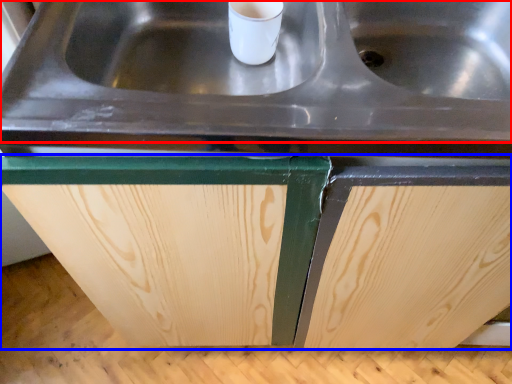
Question: Among these objects, which one is farthest to the camera, sink (highlighted by a red box) or cabinetry (highlighted by a blue box)?

Choices:
 (A) sink
 (B) cabinetry

Answer: (B)